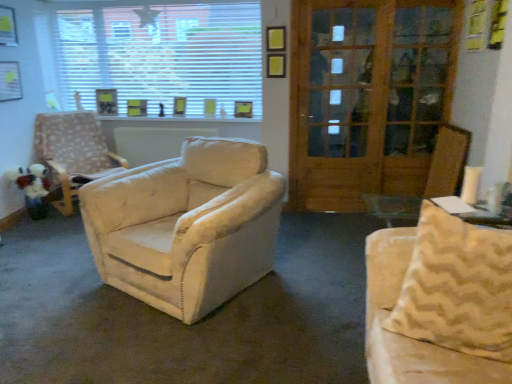
Question: Is white plush toy at left wider or thinner than wooden screen door at right?

Choices:
 (A) wide
 (B) thin

Answer: (A)

Question: From their relative heights in the image, would you say white plush toy at left is taller or shorter than wooden screen door at right?

Choices:
 (A) short
 (B) tall

Answer: (A)

Question: Estimate the real-world distances between objects in this image. Which object is farther from the wooden screen door at right?

Choices:
 (A) white blinds at upper center
 (B) beige fabric couch at right
 (C) wooden door at center
 (D) beige fabric armchair at left
 (E) white plush toy at left

Answer: (E)

Question: Considering the real-world distances, which object is farthest from the white plush toy at left?

Choices:
 (A) beige fabric couch at right
 (B) beige fabric armchair at left
 (C) wooden door at center
 (D) white blinds at upper center
 (E) wooden screen door at right

Answer: (A)